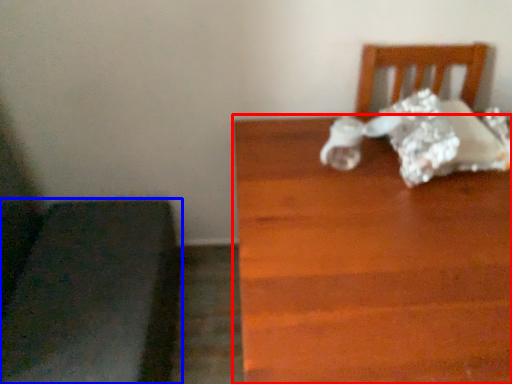
Question: Which point is closer to the camera, table (highlighted by a red box) or furniture (highlighted by a blue box)?

Choices:
 (A) table
 (B) furniture

Answer: (A)